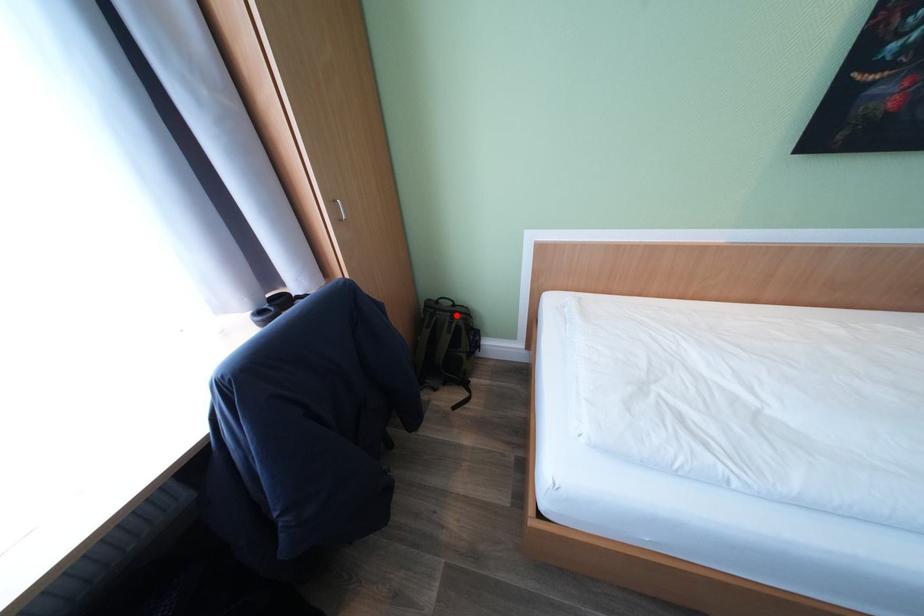
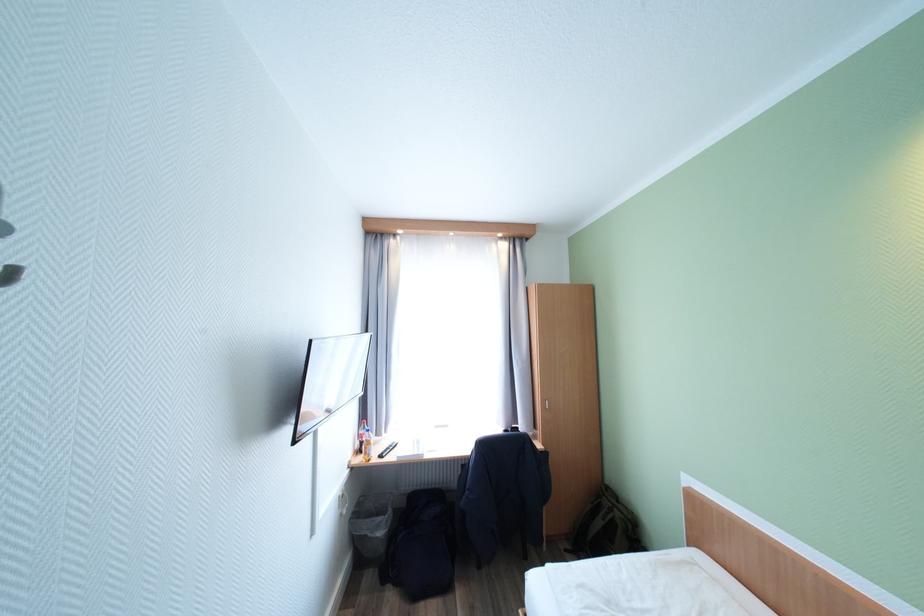
Where in the second image is the point corresponding to the highlighted location from the first image?

(617, 506)